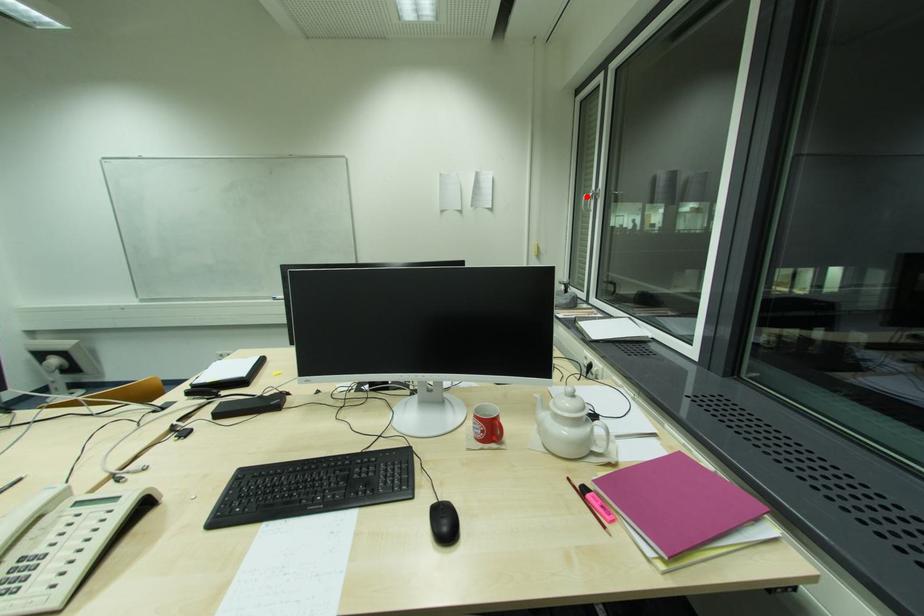
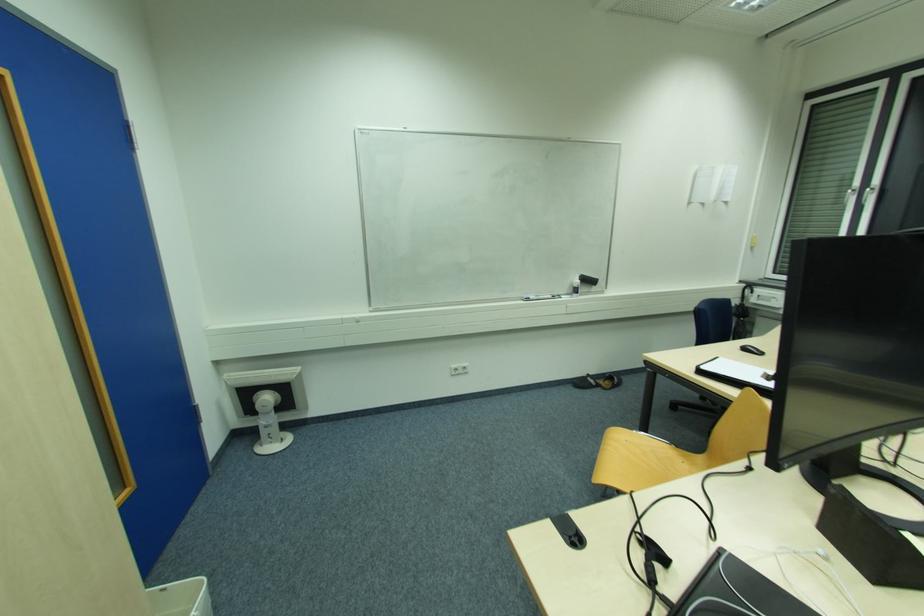
Question: I am providing you with two images of the same scene from different viewpoints. A red point is shown in image1. For the corresponding object point in image2, is it positioned nearer or farther from the camera?

Choices:
 (A) Nearer
 (B) Farther

Answer: (B)